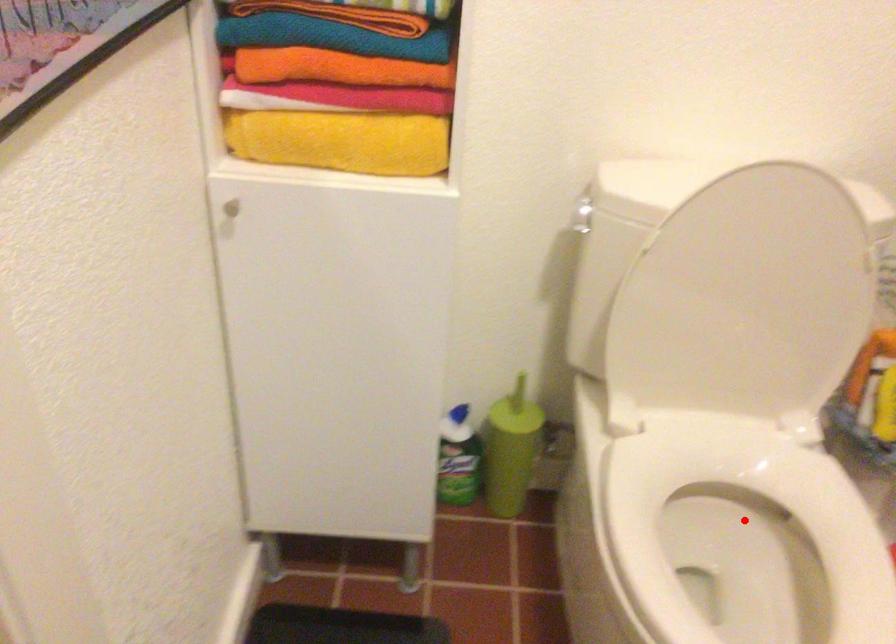
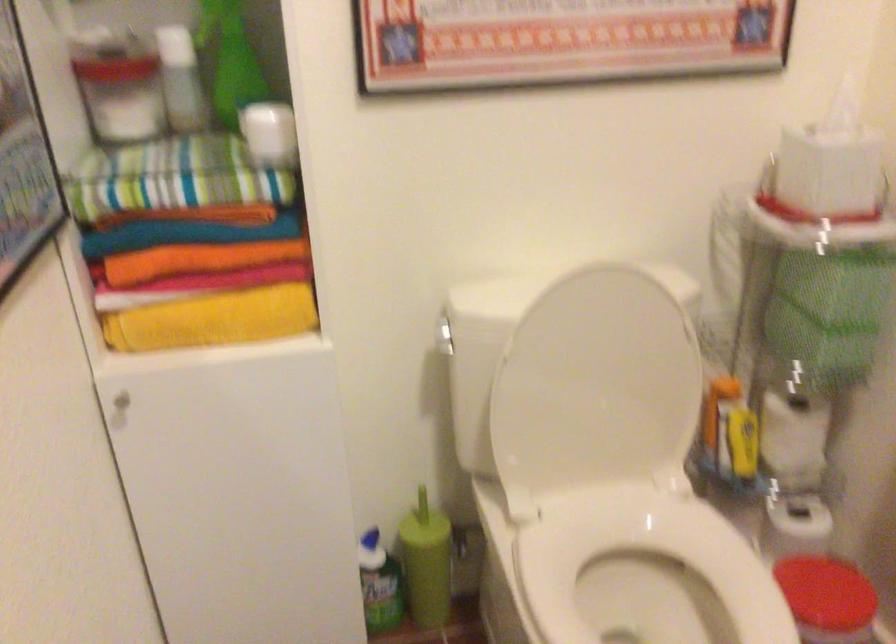
Question: I am providing you with two images of the same scene from different viewpoints. A red point is marked on the first image. Can you still see the location of the red point in image 2?

Choices:
 (A) Yes
 (B) No

Answer: (A)